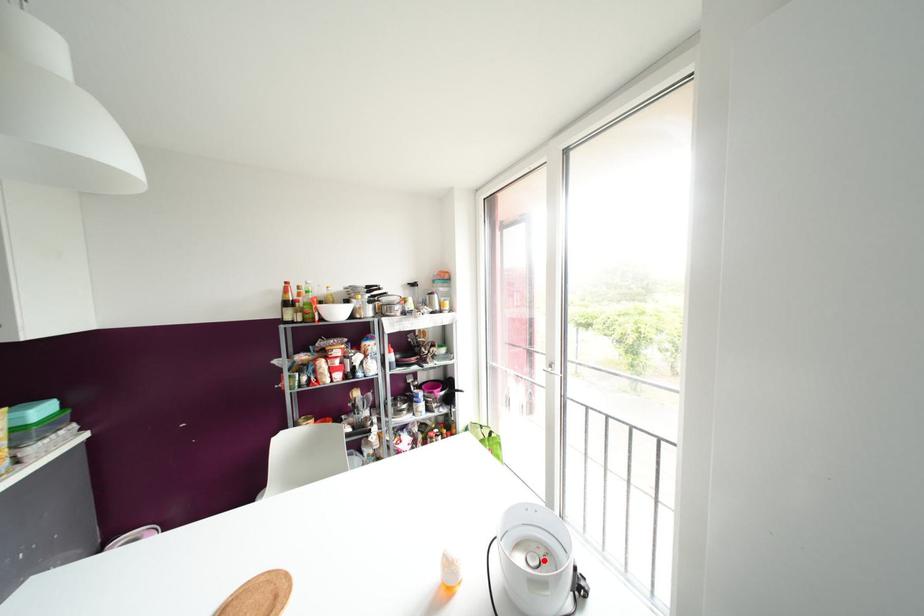
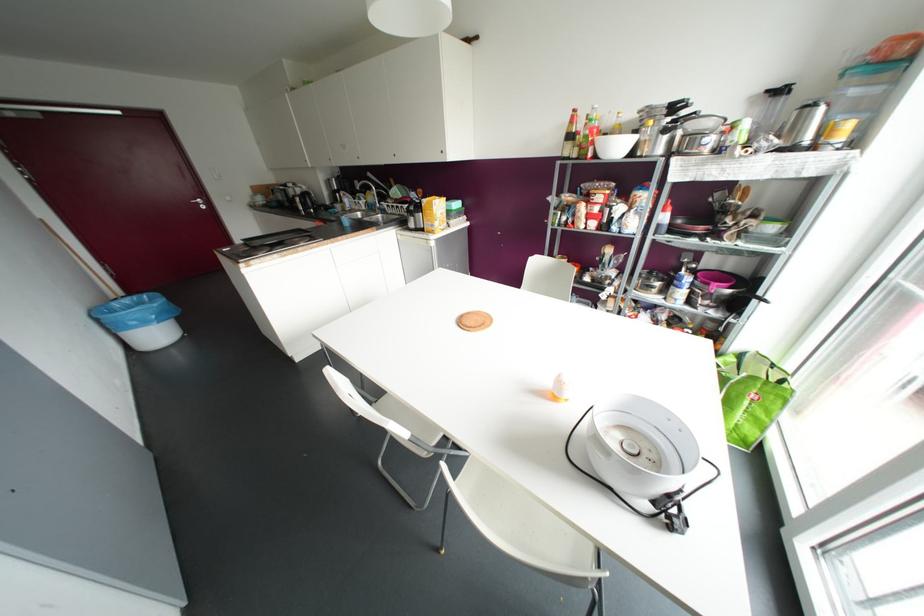
Locate, in the second image, the point that corresponds to the highlighted location in the first image.

(642, 459)